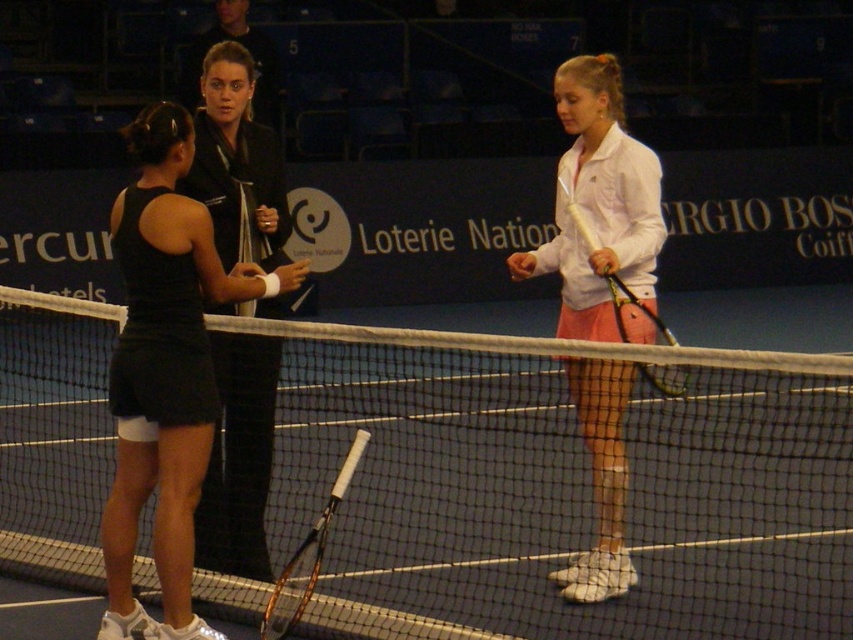
Question: Is black matte tennis skirt at left positioned behind white matte tennis racket at center?

Choices:
 (A) yes
 (B) no

Answer: (A)

Question: Which point is farther to the camera?

Choices:
 (A) (294, 573)
 (B) (624, 323)

Answer: (B)

Question: Does black fabric jacket at center appear over yellow grip tennis racket at center?

Choices:
 (A) yes
 (B) no

Answer: (B)

Question: Estimate the real-world distances between objects in this image. Which object is farther from the white mesh net at center?

Choices:
 (A) white matte tennis racket at center
 (B) black matte tennis skirt at left
 (C) yellow grip tennis racket at center

Answer: (B)

Question: Which of the following is the closest to the observer?

Choices:
 (A) brown wooden tennis racket at center
 (B) black matte tennis skirt at left
 (C) black fabric jacket at center
 (D) white mesh net at center

Answer: (A)

Question: Does black matte tennis skirt at left appear on the right side of brown wooden tennis racket at center?

Choices:
 (A) yes
 (B) no

Answer: (B)